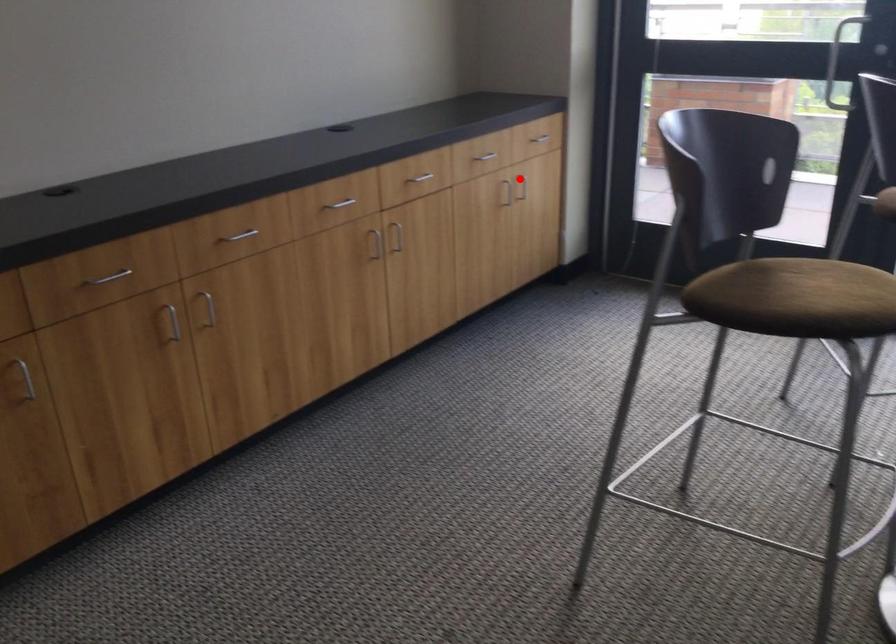
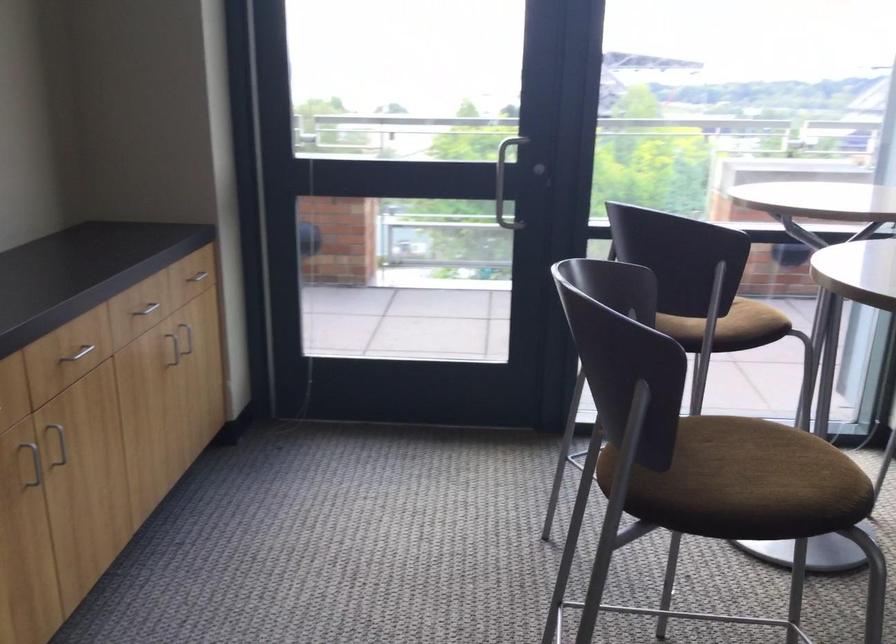
Question: I am providing you with two images of the same scene from different viewpoints. Given a red point in image1, look at the same physical point in image2. Is it:

Choices:
 (A) Closer to the viewpoint
 (B) Farther from the viewpoint

Answer: (A)